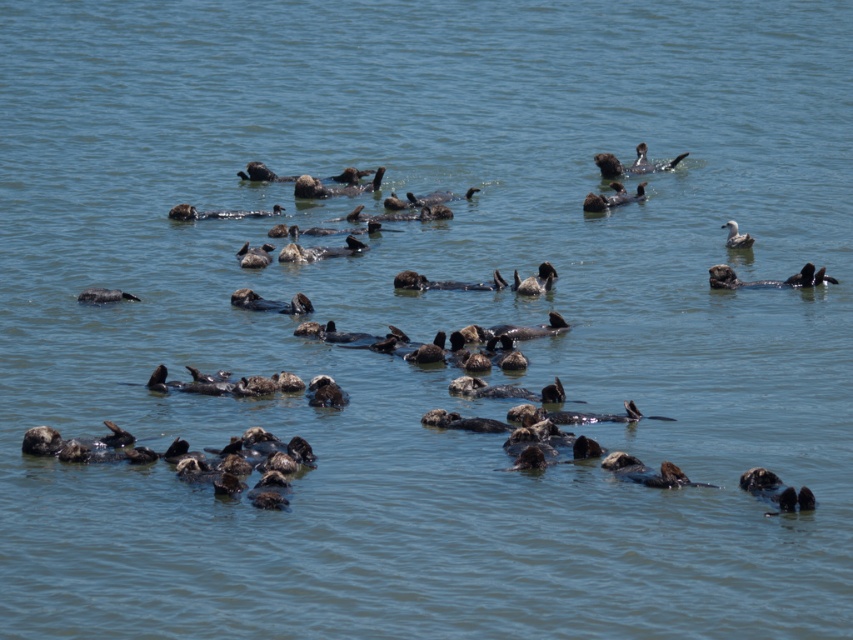
Question: Which of the following is the farthest from the observer?

Choices:
 (A) dark brown fur seal at right
 (B) dark brown fuzzy duck at center
 (C) dark brown duck at center
 (D) white fluffy duck at upper right

Answer: (D)

Question: Which point appears closest to the camera in this image?

Choices:
 (A) (242, 246)
 (B) (811, 266)

Answer: (B)

Question: Does dark brown fuzzy duck at center have a smaller size compared to white fluffy duck at upper right?

Choices:
 (A) no
 (B) yes

Answer: (A)

Question: Which point appears farthest from the camera in this image?

Choices:
 (A) pyautogui.click(x=556, y=275)
 (B) pyautogui.click(x=254, y=252)
 (C) pyautogui.click(x=726, y=237)

Answer: (C)

Question: Is dark brown fuzzy duck at center further to the viewer compared to dark brown duck at center?

Choices:
 (A) yes
 (B) no

Answer: (B)

Question: Can you confirm if dark brown fuzzy duck at center is thinner than white fluffy duck at upper right?

Choices:
 (A) no
 (B) yes

Answer: (A)